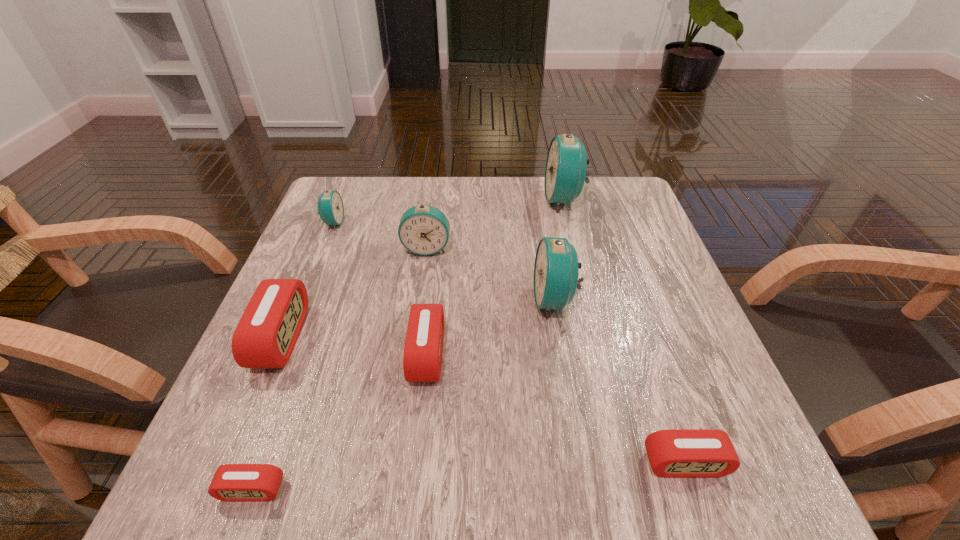
I want to click on the tallest object, so click(565, 172).

The height and width of the screenshot is (540, 960). Identify the location of the tallest alarm clock. (565, 172).

The width and height of the screenshot is (960, 540). In order to click on the third smallest blue alarm clock in this screenshot , I will do `click(555, 281)`.

You are a GUI agent. You are given a task and a screenshot of the screen. Output one action in this format:
    pyautogui.click(x=<x>, y=<y>)
    Task: Click on the seventh shortest alarm clock
    Image resolution: width=960 pixels, height=540 pixels.
    Given the screenshot: What is the action you would take?
    pyautogui.click(x=555, y=281)

Image resolution: width=960 pixels, height=540 pixels. What are the coordinates of `the second smallest blue alarm clock` in the screenshot? It's located at (424, 230).

I want to click on the sixth shortest alarm clock, so pos(424,230).

Find the location of `the smallest blue alarm clock`. the smallest blue alarm clock is located at coordinates (330, 209).

Where is `the biggest pink alarm clock`? This screenshot has width=960, height=540. the biggest pink alarm clock is located at coordinates (265, 336).

You are a GUI agent. You are given a task and a screenshot of the screen. Output one action in this format:
    pyautogui.click(x=<x>, y=<y>)
    Task: Click on the second pink alarm clock from right to left
    This screenshot has height=540, width=960.
    Given the screenshot: What is the action you would take?
    pyautogui.click(x=422, y=360)

Where is `the third shortest alarm clock`? This screenshot has height=540, width=960. the third shortest alarm clock is located at coordinates (422, 360).